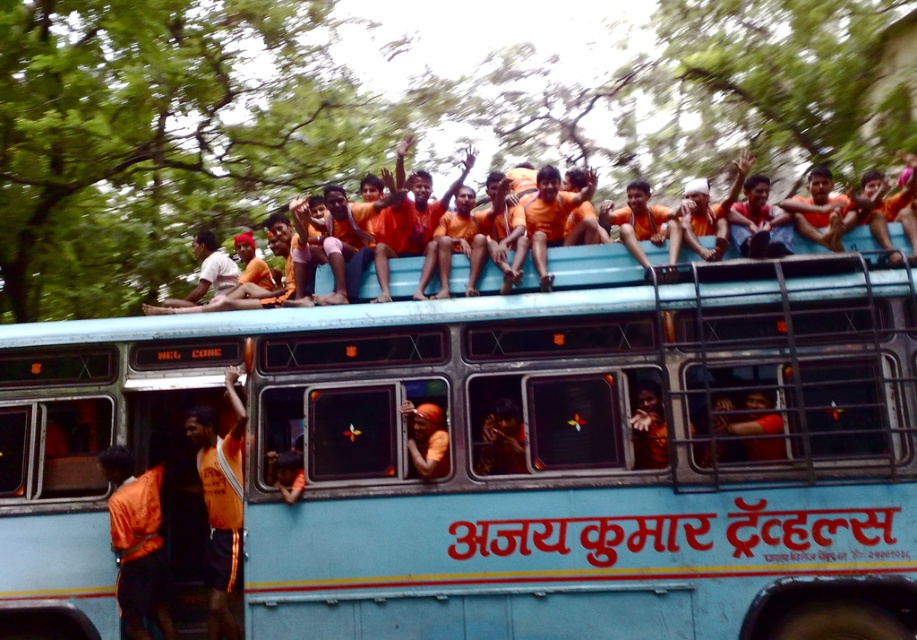
Question: Which object is closer to the camera taking this photo?

Choices:
 (A) orange fabric shirt at upper center
 (B) orange shirt at center
 (C) orange fabric shirt at center
 (D) light blue metallic bus at upper center

Answer: (C)

Question: Which of the following is the closest to the observer?

Choices:
 (A) orange fabric headband at upper center
 (B) orange fabric shirt at lower left
 (C) orange fabric shirt at center
 (D) orange shirt at upper center

Answer: (D)

Question: Does orange fabric shirt at upper center appear on the right side of orange fabric shirt at center?

Choices:
 (A) no
 (B) yes

Answer: (B)

Question: Which object is positioned closest to the matte orange shirt at upper left?

Choices:
 (A) orange fabric shirt at lower left
 (B) orange shirt at upper center

Answer: (A)

Question: Does orange fabric shirt at upper center have a smaller size compared to orange fabric headband at upper center?

Choices:
 (A) no
 (B) yes

Answer: (B)

Question: Does orange fabric shirt at upper center have a greater width compared to orange shirt at upper center?

Choices:
 (A) no
 (B) yes

Answer: (B)